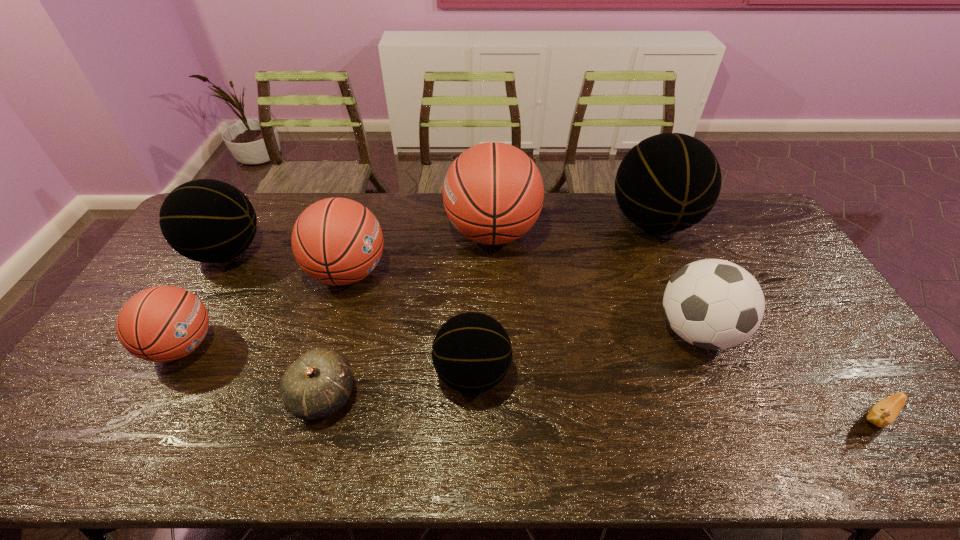
At what (x,y) coordinates should I click in order to perform the action: click on vacant region at the far edge of the desktop. Please return your answer as a coordinate pair (x, y). This screenshot has width=960, height=540. Looking at the image, I should click on (294, 222).

Locate an element on the screen. The image size is (960, 540). vacant space at the near edge of the desktop is located at coordinates (399, 464).

Find the location of a particular element. Image resolution: width=960 pixels, height=540 pixels. free spot between the fourth basketball from right to left and the smallest black basketball is located at coordinates (410, 323).

The width and height of the screenshot is (960, 540). Identify the location of vacant space that is in between the second smallest orange basketball and the second smallest black basketball. (287, 262).

Where is `vacant region between the rightmost black basketball and the gourd`? The image size is (960, 540). vacant region between the rightmost black basketball and the gourd is located at coordinates (488, 309).

Find the location of a particular element. blank region between the smallest orange basketball and the second shortest object is located at coordinates (252, 370).

The width and height of the screenshot is (960, 540). I want to click on vacant area between the rightmost orange basketball and the rightmost black basketball, so click(x=572, y=227).

The height and width of the screenshot is (540, 960). In order to click on free spot between the second black basketball from right to left and the second orange basketball from right to left in this screenshot , I will do `click(410, 323)`.

Locate an element on the screen. The width and height of the screenshot is (960, 540). free space between the second shortest object and the rightmost black basketball is located at coordinates (488, 309).

Locate an element on the screen. This screenshot has height=540, width=960. free area in between the fourth basketball from right to left and the second black basketball from right to left is located at coordinates (410, 323).